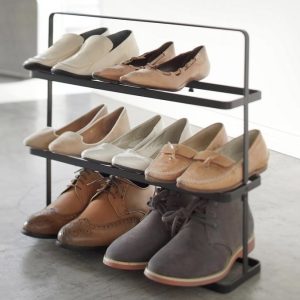
At what (x,y) coordinates should I click in order to perform the action: click on shoes on bottom shelf. Please return your answer as a coordinate pair (x, y). The image size is (300, 300). Looking at the image, I should click on (177, 252), (150, 240), (109, 224), (55, 211).